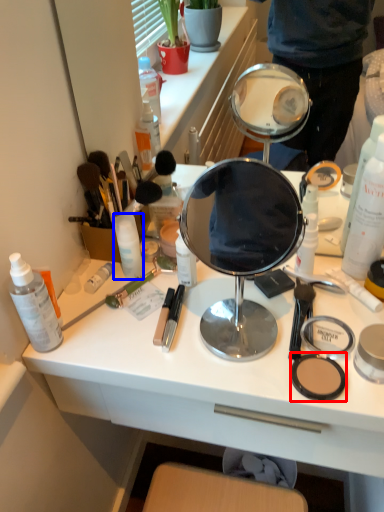
Question: Which object appears closest to the camera in this image, face powder (highlighted by a red box) or toiletry (highlighted by a blue box)?

Choices:
 (A) face powder
 (B) toiletry

Answer: (A)